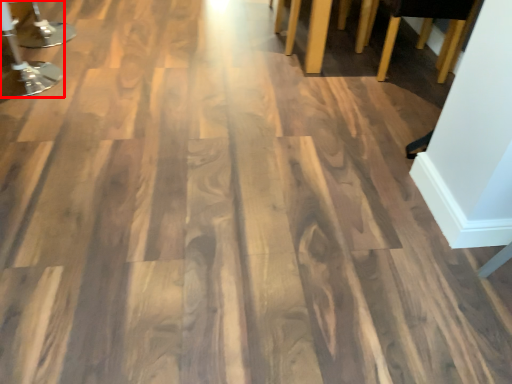
Question: From the image's perspective, where is furniture (annotated by the red box) located relative to furniture?

Choices:
 (A) above
 (B) below

Answer: (B)